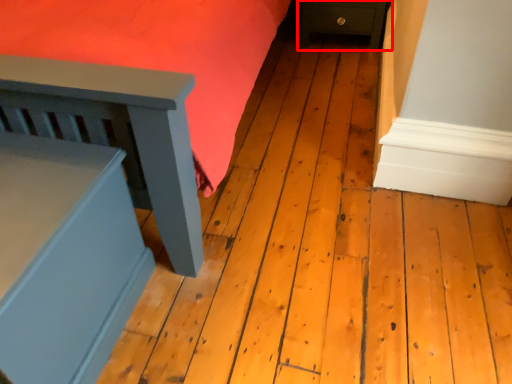
Question: Observing the image, what is the correct spatial positioning of furniture (annotated by the red box) in reference to furniture?

Choices:
 (A) right
 (B) left

Answer: (A)